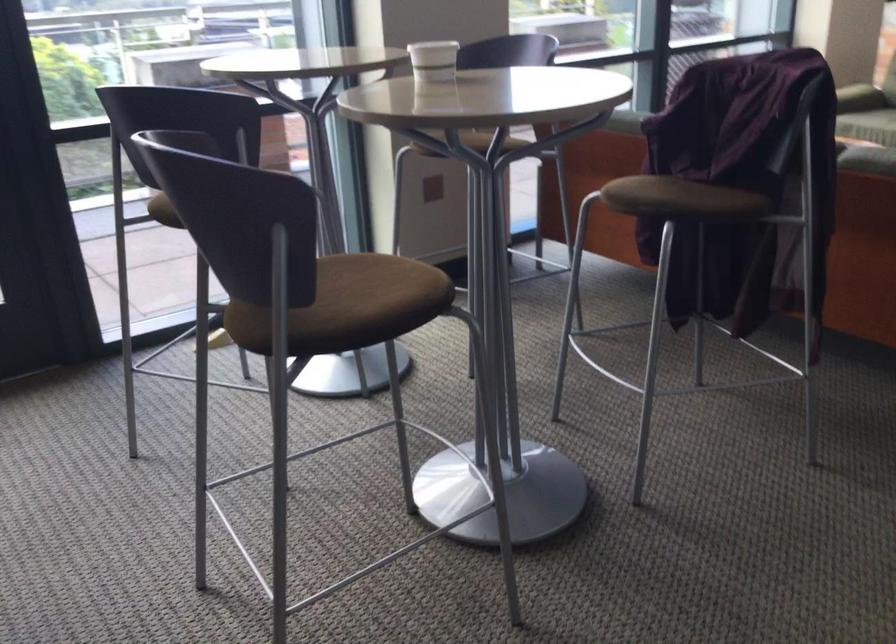
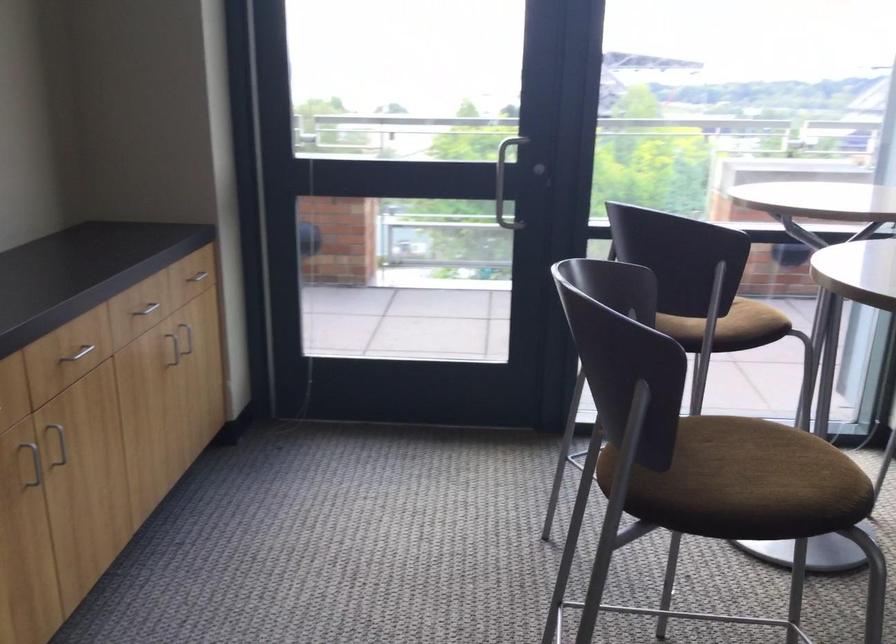
In the second image, find the point that corresponds to pixel 364 305 in the first image.

(739, 482)